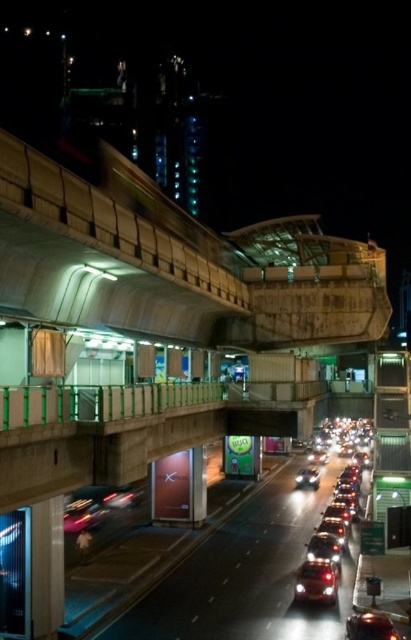
Is shiny metallic car at center-right above shiny red car at center?

No, shiny metallic car at center-right is not above shiny red car at center.

Does shiny metallic car at center-right appear on the left side of shiny red car at center?

No, shiny metallic car at center-right is not to the left of shiny red car at center.

Locate an element on the screen. shiny metallic car at center-right is located at coordinates (334, 525).

Where is `shiny metallic car at center-right`? shiny metallic car at center-right is located at coordinates (334, 525).